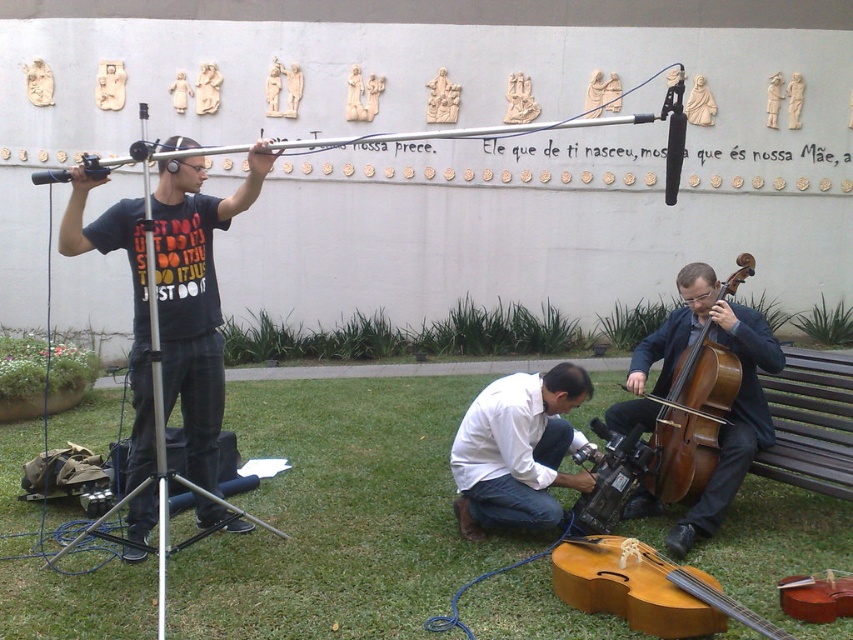
Does black matte t-shirt at upper left have a lesser height compared to wooden violin at lower right?

No, black matte t-shirt at upper left is not shorter than wooden violin at lower right.

The width and height of the screenshot is (853, 640). What do you see at coordinates (195, 298) in the screenshot? I see `black matte t-shirt at upper left` at bounding box center [195, 298].

Does point (65, 227) lie in front of point (824, 621)?

No, (65, 227) is behind (824, 621).

Identify the location of black matte t-shirt at upper left. (195, 298).

Is white matte shirt at center thinner than wooden violin at lower right?

No.

Which of these two, white matte shirt at center or wooden violin at lower right, stands taller?

With more height is white matte shirt at center.

Between point (474, 420) and point (820, 595), which one is positioned behind?

Positioned behind is point (474, 420).

Find the location of a particular element. The width and height of the screenshot is (853, 640). white matte shirt at center is located at coordinates (517, 451).

Is light brown wood violin at lower center in front of brown wooden cello at lower right?

Yes.

Measure the distance from light brown wood violin at lower center to brown wooden cello at lower right.

light brown wood violin at lower center and brown wooden cello at lower right are 34.68 inches apart from each other.

Does point (628, 570) come in front of point (708, 392)?

Yes, it is.

Find the location of a particular element. light brown wood violin at lower center is located at coordinates (645, 589).